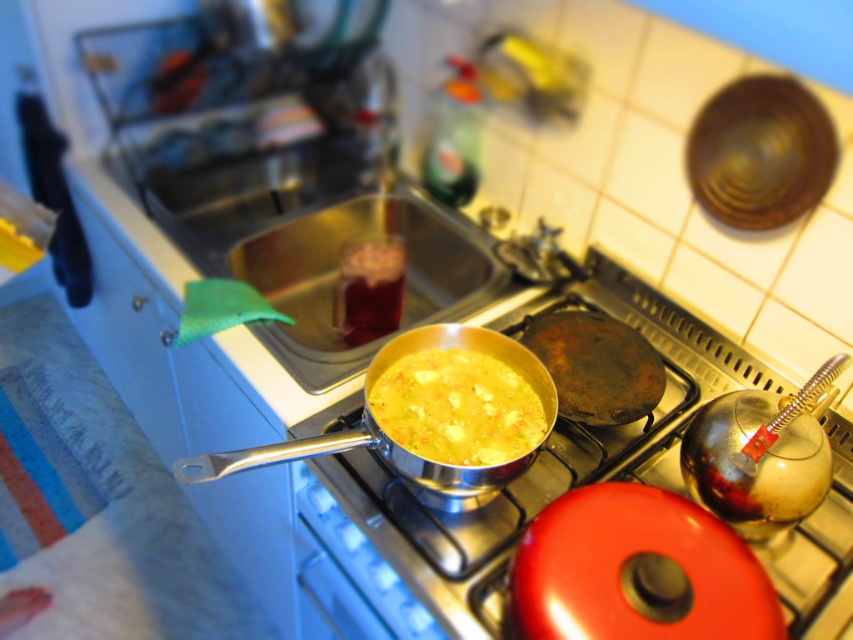
What object is located at the coordinates point [519,476]?

The silver metallic pan at center is located at point [519,476].

Consider the image. You are a chef preparing a dish and need to determine which item is taller between the silver metallic pan at center and the yellow matte soup at center. Based on the scene, which one is taller?

The silver metallic pan at center is taller than the yellow matte soup at center.

You are a chef trying to place a new utensil on the counter next to the silver metallic pan at center. According to the image, where should you place the utensil to ensure it doesn

The silver metallic pan at center is located at point (x=519, y=476), so you should place the utensil near that coordinate to keep it close.